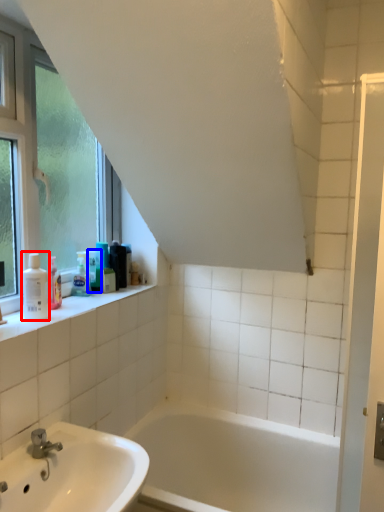
Question: Which object appears closest to the camera in this image, toiletry (highlighted by a red box) or toiletry (highlighted by a blue box)?

Choices:
 (A) toiletry
 (B) toiletry

Answer: (A)